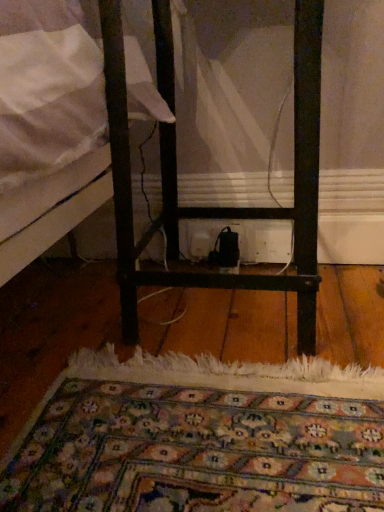
Question: Is black metal nightstand at center far away from carpeted rug at center?

Choices:
 (A) no
 (B) yes

Answer: (A)

Question: Does black metal nightstand at center have a lesser width compared to carpeted rug at center?

Choices:
 (A) no
 (B) yes

Answer: (B)

Question: From the image's perspective, would you say black metal nightstand at center is shown under carpeted rug at center?

Choices:
 (A) no
 (B) yes

Answer: (A)

Question: Is black metal nightstand at center completely or partially outside of carpeted rug at center?

Choices:
 (A) no
 (B) yes

Answer: (B)

Question: From a real-world perspective, does black metal nightstand at center sit lower than carpeted rug at center?

Choices:
 (A) no
 (B) yes

Answer: (A)

Question: In terms of height, does carpeted rug at center look taller or shorter compared to black metal nightstand at center?

Choices:
 (A) tall
 (B) short

Answer: (B)

Question: Is carpeted rug at center wider or thinner than black metal nightstand at center?

Choices:
 (A) wide
 (B) thin

Answer: (A)

Question: Is carpeted rug at center inside the boundaries of black metal nightstand at center, or outside?

Choices:
 (A) outside
 (B) inside

Answer: (A)

Question: In terms of size, does carpeted rug at center appear bigger or smaller than black metal nightstand at center?

Choices:
 (A) big
 (B) small

Answer: (B)

Question: Relative to white plastic electric outlet at center, is carpeted rug at center in front or behind?

Choices:
 (A) front
 (B) behind

Answer: (A)

Question: Is carpeted rug at center wider or thinner than white plastic electric outlet at center?

Choices:
 (A) wide
 (B) thin

Answer: (A)

Question: From a real-world perspective, relative to white plastic electric outlet at center, is carpeted rug at center vertically above or below?

Choices:
 (A) below
 (B) above

Answer: (A)

Question: In terms of height, does carpeted rug at center look taller or shorter compared to white plastic electric outlet at center?

Choices:
 (A) short
 (B) tall

Answer: (A)

Question: In terms of size, does black metal nightstand at center appear bigger or smaller than carpeted rug at center?

Choices:
 (A) big
 (B) small

Answer: (A)

Question: Visually, is black metal nightstand at center positioned to the left or to the right of carpeted rug at center?

Choices:
 (A) left
 (B) right

Answer: (B)